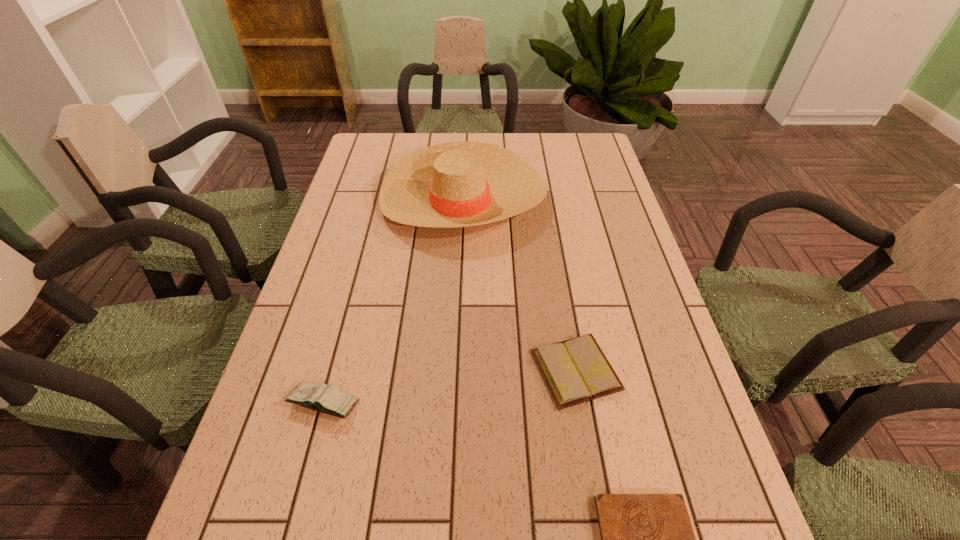
The width and height of the screenshot is (960, 540). In order to click on diary identified as the closest to the second tallest object in this screenshot , I will do `click(576, 370)`.

You are a GUI agent. You are given a task and a screenshot of the screen. Output one action in this format:
    pyautogui.click(x=<x>, y=<y>)
    Task: Click on the diary that is the second closest to the nearest diary
    Image resolution: width=960 pixels, height=540 pixels.
    Given the screenshot: What is the action you would take?
    pos(326,399)